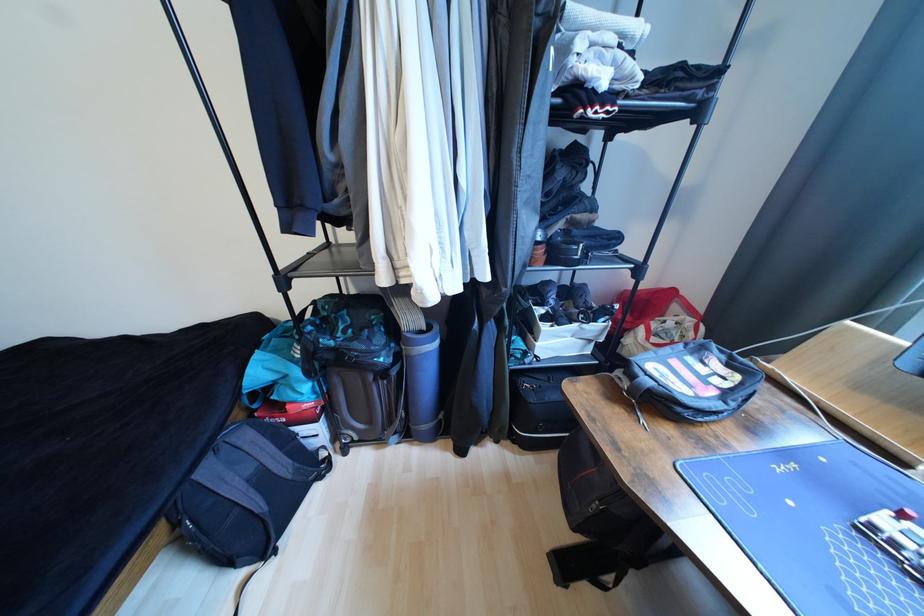
Find where to lift the black backpack. Please return your answer as a coordinate pair (x, y).

(246, 492)